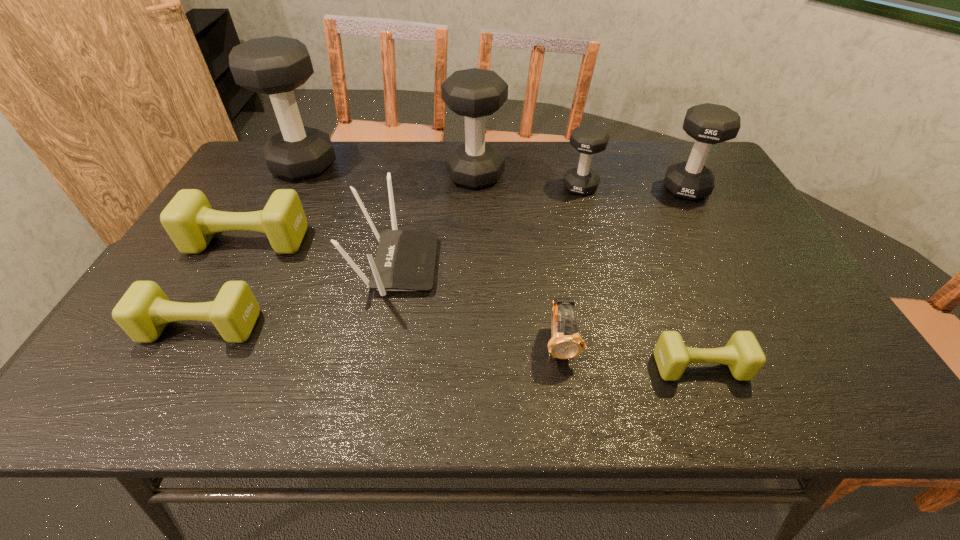
The width and height of the screenshot is (960, 540). Find the location of `the biggest gray dumbbell`. the biggest gray dumbbell is located at coordinates (276, 65).

This screenshot has height=540, width=960. I want to click on the leftmost gray dumbbell, so click(x=276, y=65).

In order to click on the fifth object from left to right in this screenshot , I will do `click(474, 93)`.

I want to click on the third gray dumbbell from right to left, so click(474, 93).

The width and height of the screenshot is (960, 540). Identify the location of the second smallest gray dumbbell. (708, 124).

Locate an element on the screen. the rightmost object is located at coordinates (708, 124).

This screenshot has height=540, width=960. In order to click on the second gray dumbbell from right to left in this screenshot , I will do `click(588, 139)`.

The image size is (960, 540). Identify the location of the fourth tallest dumbbell. pos(588,139).

Image resolution: width=960 pixels, height=540 pixels. In order to click on router in this screenshot , I will do `click(405, 261)`.

You are a GUI agent. You are given a task and a screenshot of the screen. Output one action in this format:
    pyautogui.click(x=<x>, y=<y>)
    Task: Click on the fifth tallest dumbbell
    The image size is (960, 540).
    Given the screenshot: What is the action you would take?
    pyautogui.click(x=189, y=220)